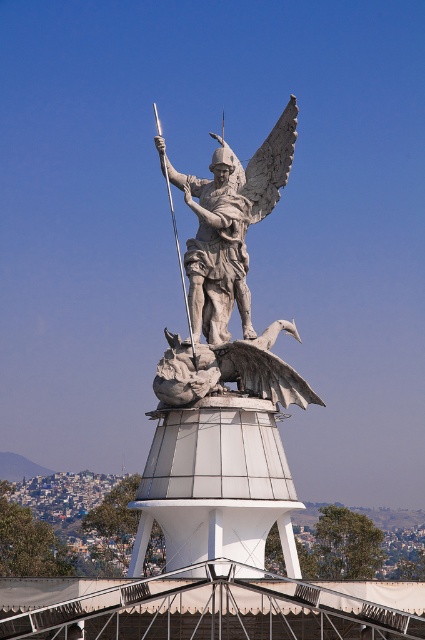
Question: Where is polished stone angel at center located in relation to polished silver spear at center in the image?

Choices:
 (A) above
 (B) below

Answer: (A)

Question: Does white stone statue at center have a lesser width compared to polished silver spear at center?

Choices:
 (A) yes
 (B) no

Answer: (B)

Question: Based on their relative distances, which object is nearer to the polished stone angel at center?

Choices:
 (A) white stone statue at center
 (B) polished silver spear at center

Answer: (A)

Question: Among these objects, which one is nearest to the camera?

Choices:
 (A) polished silver spear at center
 (B) white stone statue at center
 (C) polished stone angel at center

Answer: (B)

Question: Does polished stone angel at center appear on the right side of polished silver spear at center?

Choices:
 (A) yes
 (B) no

Answer: (A)

Question: Which of the following is the farthest from the observer?

Choices:
 (A) white stone statue at center
 (B) polished silver spear at center
 (C) polished stone angel at center

Answer: (C)